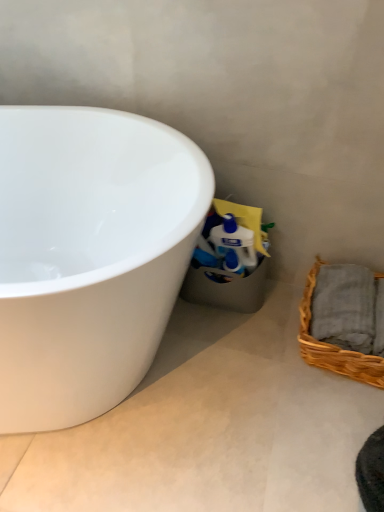
Question: Does white glossy bathtub at left lie behind woven brown picnic basket at lower right?

Choices:
 (A) yes
 (B) no

Answer: (B)

Question: Is white glossy bathtub at left to the left of woven brown picnic basket at lower right from the viewer's perspective?

Choices:
 (A) no
 (B) yes

Answer: (B)

Question: Does white glossy bathtub at left have a lesser width compared to woven brown picnic basket at lower right?

Choices:
 (A) yes
 (B) no

Answer: (B)

Question: Does white glossy bathtub at left lie in front of woven brown picnic basket at lower right?

Choices:
 (A) yes
 (B) no

Answer: (A)

Question: Considering the relative sizes of white glossy bathtub at left and woven brown picnic basket at lower right in the image provided, is white glossy bathtub at left shorter than woven brown picnic basket at lower right?

Choices:
 (A) no
 (B) yes

Answer: (A)

Question: From a real-world perspective, is white glossy bathtub at left positioned over woven brown picnic basket at lower right based on gravity?

Choices:
 (A) no
 (B) yes

Answer: (B)

Question: Is white glossy concrete at lower left turned away from white glossy bathtub at left?

Choices:
 (A) yes
 (B) no

Answer: (B)

Question: Is white glossy concrete at lower left positioned behind white glossy bathtub at left?

Choices:
 (A) yes
 (B) no

Answer: (A)

Question: Is white glossy concrete at lower left aimed at white glossy bathtub at left?

Choices:
 (A) no
 (B) yes

Answer: (A)

Question: Can we say white glossy concrete at lower left lies outside white glossy bathtub at left?

Choices:
 (A) yes
 (B) no

Answer: (A)

Question: Considering the relative sizes of white glossy concrete at lower left and white glossy bathtub at left in the image provided, is white glossy concrete at lower left shorter than white glossy bathtub at left?

Choices:
 (A) no
 (B) yes

Answer: (B)

Question: Is white glossy bathtub at left surrounded by white glossy concrete at lower left?

Choices:
 (A) yes
 (B) no

Answer: (B)

Question: Is woven brown picnic basket at lower right outside of white glossy bathtub at left?

Choices:
 (A) no
 (B) yes

Answer: (B)